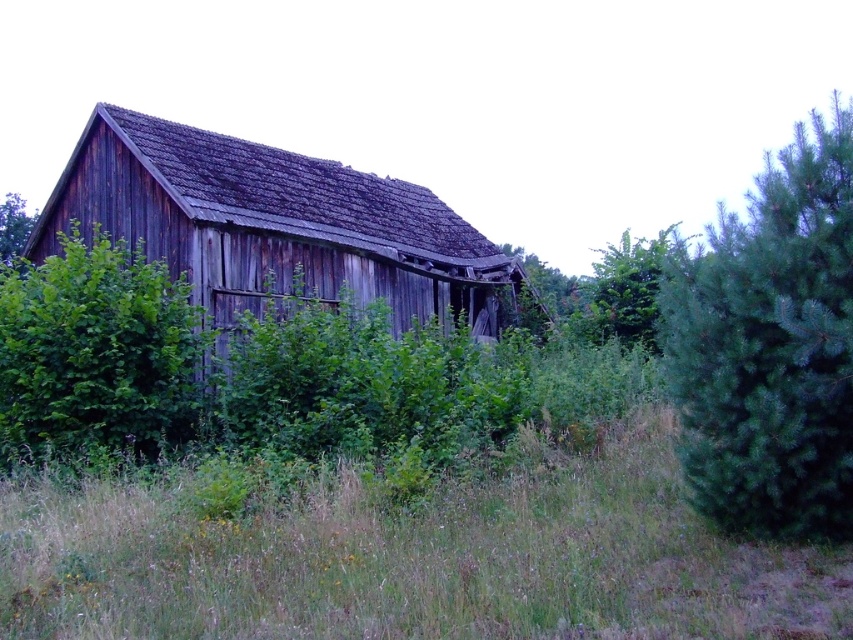
Consider the image. Who is more distant from viewer, (619, 305) or (0, 252)?

Point (0, 252)

Who is higher up, green leafy tree at center or green leafy tree at upper left?

green leafy tree at upper left

Consider the image. Who is more forward, (x=663, y=244) or (x=16, y=237)?

Point (x=663, y=244) is in front.

Find the location of a particular element. The height and width of the screenshot is (640, 853). green leafy tree at center is located at coordinates tap(630, 289).

Measure the distance between green grass at center and camera.

4.63 meters

Does green grass at center have a larger size compared to green leafy tree at upper left?

Actually, green grass at center might be smaller than green leafy tree at upper left.

This screenshot has height=640, width=853. What do you see at coordinates (416, 561) in the screenshot? I see `green grass at center` at bounding box center [416, 561].

Image resolution: width=853 pixels, height=640 pixels. Identify the location of green grass at center. (416, 561).

Is point (750, 360) positioned behind point (627, 333)?

No, (750, 360) is in front of (627, 333).

Identify the location of green needle-like tree at right. Image resolution: width=853 pixels, height=640 pixels. (770, 346).

The image size is (853, 640). Find the location of `green needle-like tree at right`. green needle-like tree at right is located at coordinates (770, 346).